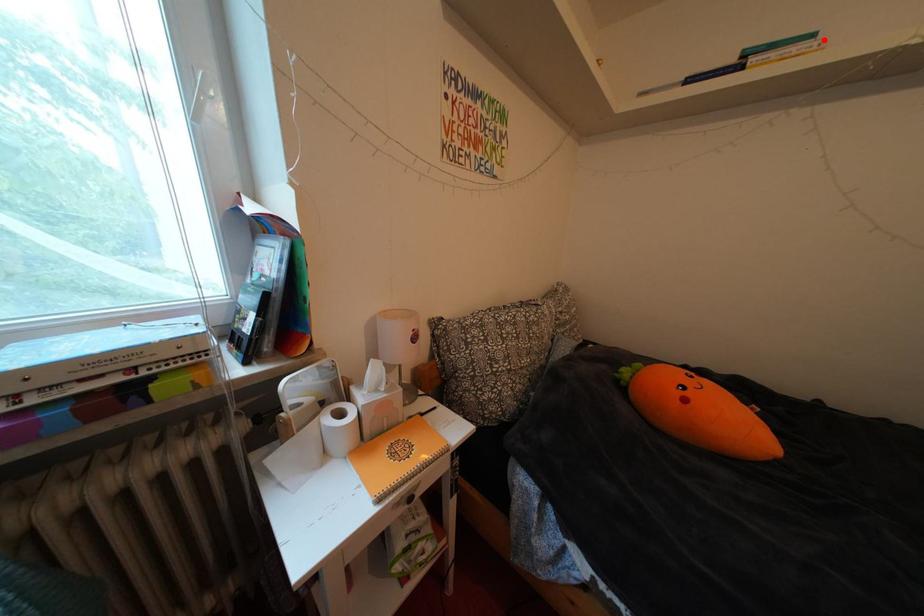
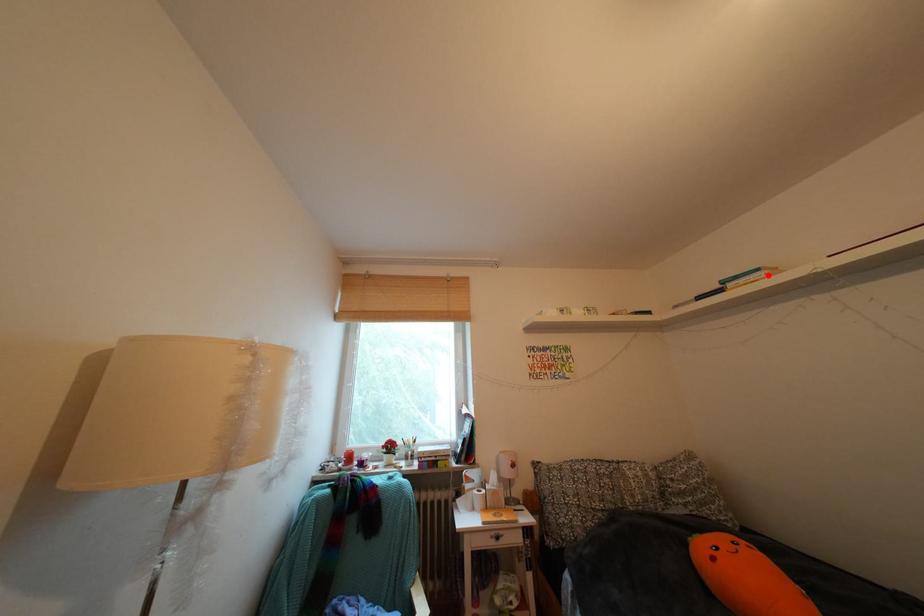
I am providing you with two images of the same scene from different viewpoints. A red point is marked on the first image and another point is marked on the second image. Is the red point in image1 aligned with the point shown in image2?

Yes